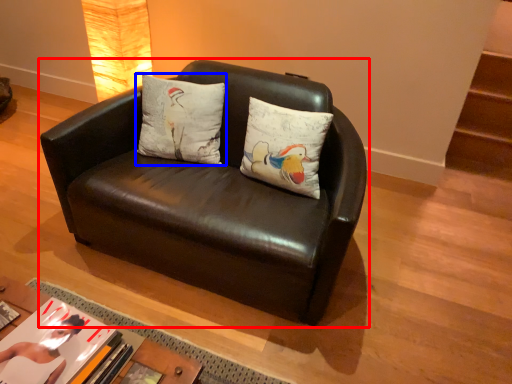
Question: Which of the following is the closest to the observer, studio couch (highlighted by a red box) or pillow (highlighted by a blue box)?

Choices:
 (A) studio couch
 (B) pillow

Answer: (A)